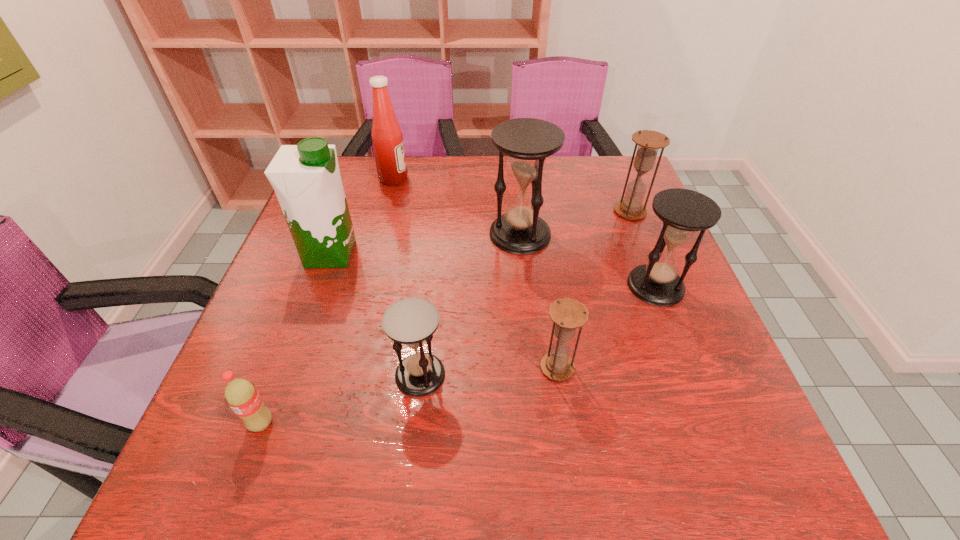
In the image, there is a desktop. Identify the location of vacant space at the left edge. This screenshot has width=960, height=540. (310, 355).

Locate an element on the screen. The width and height of the screenshot is (960, 540). vacant space at the right edge of the desktop is located at coordinates (728, 395).

Locate an element on the screen. The width and height of the screenshot is (960, 540). vacant area at the near left corner is located at coordinates (229, 495).

Image resolution: width=960 pixels, height=540 pixels. In the image, there is a desktop. What are the coordinates of `vacant area at the far right corner` in the screenshot? It's located at [x=622, y=179].

Where is `vacant space that's between the sixth object from right to left and the smaller brown hourglass`? Image resolution: width=960 pixels, height=540 pixels. vacant space that's between the sixth object from right to left and the smaller brown hourglass is located at coordinates (475, 273).

Locate an element on the screen. This screenshot has width=960, height=540. vacant space that is in between the farther brown hourglass and the leftmost black hourglass is located at coordinates (525, 293).

Image resolution: width=960 pixels, height=540 pixels. I want to click on vacant area between the soya milk and the smallest black hourglass, so click(x=375, y=314).

Where is `free area in between the leftmost hourglass and the condiment`? This screenshot has height=540, width=960. free area in between the leftmost hourglass and the condiment is located at coordinates (407, 276).

Locate an element on the screen. This screenshot has width=960, height=540. empty space between the condiment and the smallest black hourglass is located at coordinates (407, 276).

The width and height of the screenshot is (960, 540). What are the coordinates of `vacant area that lies between the smaller brown hourglass and the right brown hourglass` in the screenshot? It's located at (593, 289).